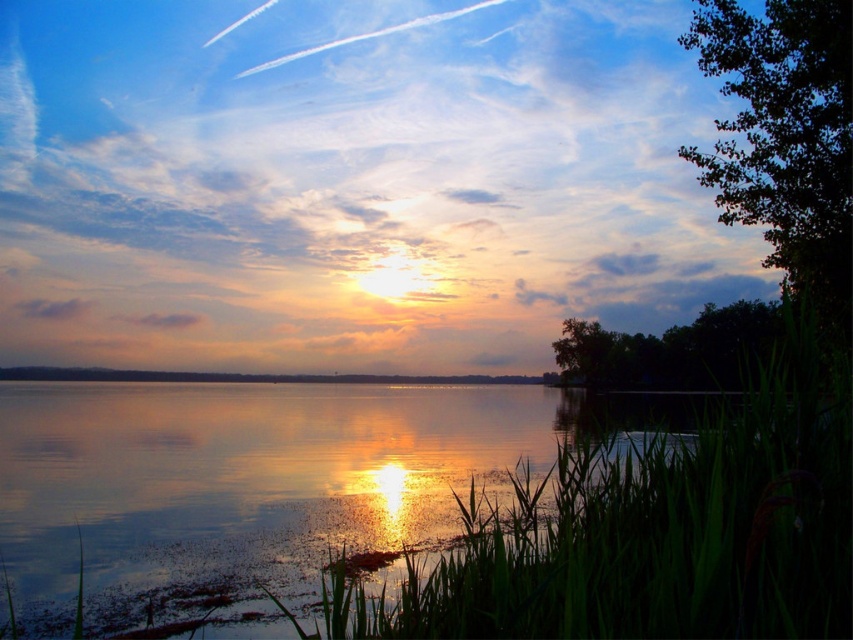
You are standing at the lakeside and want to walk towards the two points marked in the image. Which point, point [141,397] or point [691,374], will you reach first?

Point [141,397] is closer to the viewer than point [691,374], so you will reach point [141,397] first.

Consider the image. You are a photographer standing at the lakeside. You want to capture a photo of the glistening water at center and the dark green leafy tree at upper right. Which object will appear closer to the camera in the final photo?

The glistening water at center will appear closer to the camera in the final photo because the dark green leafy tree at upper right is behind it.